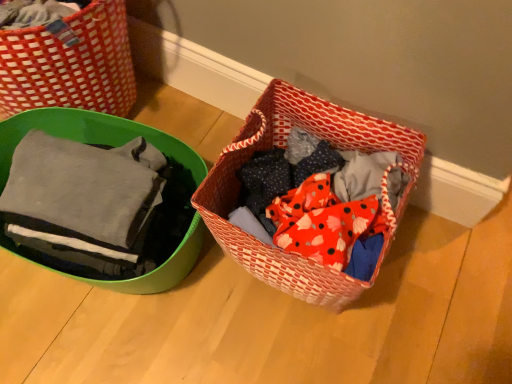
Question: From the image's perspective, relative to matte gray fabric at left, is red woven basket at center, the second picnic basket positioned from the left, above or below?

Choices:
 (A) below
 (B) above

Answer: (A)

Question: From a real-world perspective, is red woven basket at center, the 1th picnic basket in the right-to-left sequence, above or below matte gray fabric at left?

Choices:
 (A) above
 (B) below

Answer: (B)

Question: Which of these objects is positioned farthest from the matte green bowl at left, arranged as the 1th picnic basket when viewed from the left?

Choices:
 (A) red woven basket at center, the second picnic basket positioned from the left
 (B) matte gray fabric at left

Answer: (A)

Question: Which of these objects is positioned farthest from the matte gray fabric at left?

Choices:
 (A) red woven basket at center, the 1th picnic basket in the right-to-left sequence
 (B) matte green bowl at left, marked as the second picnic basket in a right-to-left arrangement

Answer: (A)